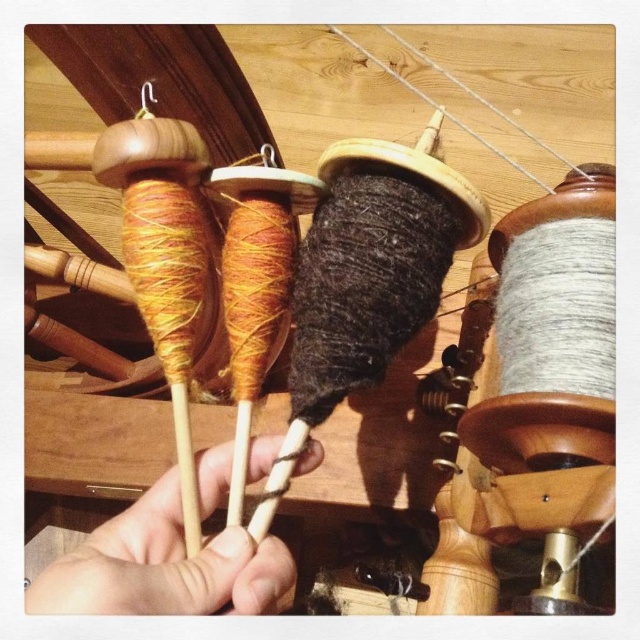
Who is lower down, wooden chopsticks at center or matte wood spindles at left?

wooden chopsticks at center is lower down.

Describe the element at coordinates (163, 566) in the screenshot. The height and width of the screenshot is (640, 640). I see `wooden chopsticks at center` at that location.

Locate an element on the screen. wooden chopsticks at center is located at coordinates (163, 566).

Is dark woolen yarn at center above wooden chopsticks at center?

Yes, dark woolen yarn at center is above wooden chopsticks at center.

Is dark woolen yarn at center shorter than wooden chopsticks at center?

Incorrect, dark woolen yarn at center's height does not fall short of wooden chopsticks at center's.

I want to click on dark woolen yarn at center, so click(364, 282).

Which is behind, point (420, 316) or point (269, 384)?

The point (269, 384) is more distant.

Who is lower down, dark woolen yarn at center or matte wood spindles at left?

Positioned lower is dark woolen yarn at center.

Locate an element on the screen. Image resolution: width=640 pixels, height=640 pixels. dark woolen yarn at center is located at coordinates (364, 282).